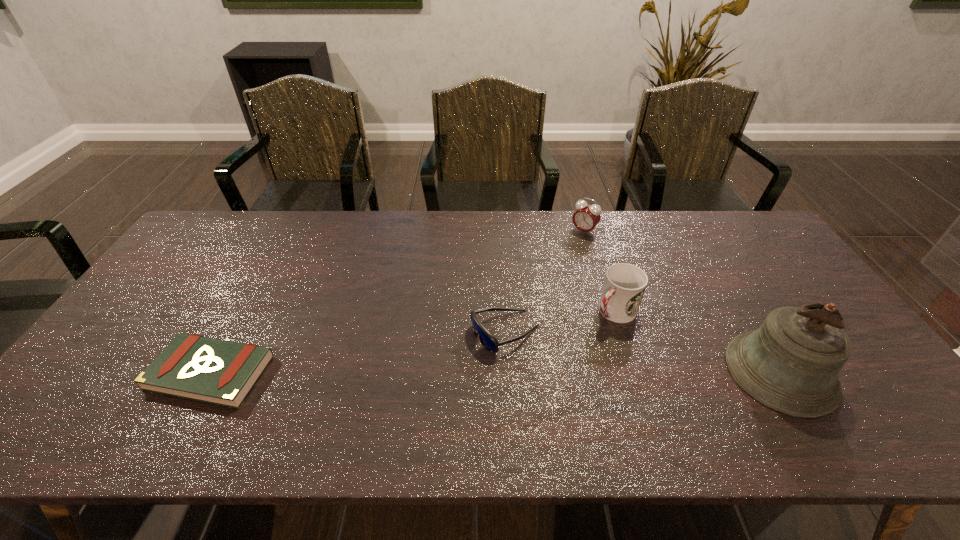
The height and width of the screenshot is (540, 960). Identify the location of free space between the farthest object and the rightmost object. (683, 301).

Where is `free space between the farthest object and the cup`? The image size is (960, 540). free space between the farthest object and the cup is located at coordinates (599, 271).

You are a GUI agent. You are given a task and a screenshot of the screen. Output one action in this format:
    pyautogui.click(x=<x>, y=<y>)
    Task: Click on the free space between the book and the farthest object
    
    Given the screenshot: What is the action you would take?
    pyautogui.click(x=397, y=302)

Locate an element on the screen. This screenshot has height=540, width=960. vacant space in between the alarm clock and the fourth object from right to left is located at coordinates (544, 282).

Where is `unoccupied area between the alarm clock and the leftmost object`? This screenshot has height=540, width=960. unoccupied area between the alarm clock and the leftmost object is located at coordinates (397, 302).

Find the location of `free space between the sunglasses and the rightmost object`. free space between the sunglasses and the rightmost object is located at coordinates (643, 352).

I want to click on vacant region between the second object from left to right and the tallest object, so click(643, 352).

Find the location of a particular element. empty space between the tallest object and the alarm clock is located at coordinates tap(683, 301).

Choose which object is the nearest neighbor to the tallest object. Please provide its 2D coordinates. Your answer should be formatted as a tuple, i.e. [(x, y)], where the tuple contains the x and y coordinates of a point satisfying the conditions above.

[(624, 285)]

Point out which object is positioned as the fourth nearest to the second object from left to right. Please provide its 2D coordinates. Your answer should be formatted as a tuple, i.e. [(x, y)], where the tuple contains the x and y coordinates of a point satisfying the conditions above.

[(220, 372)]